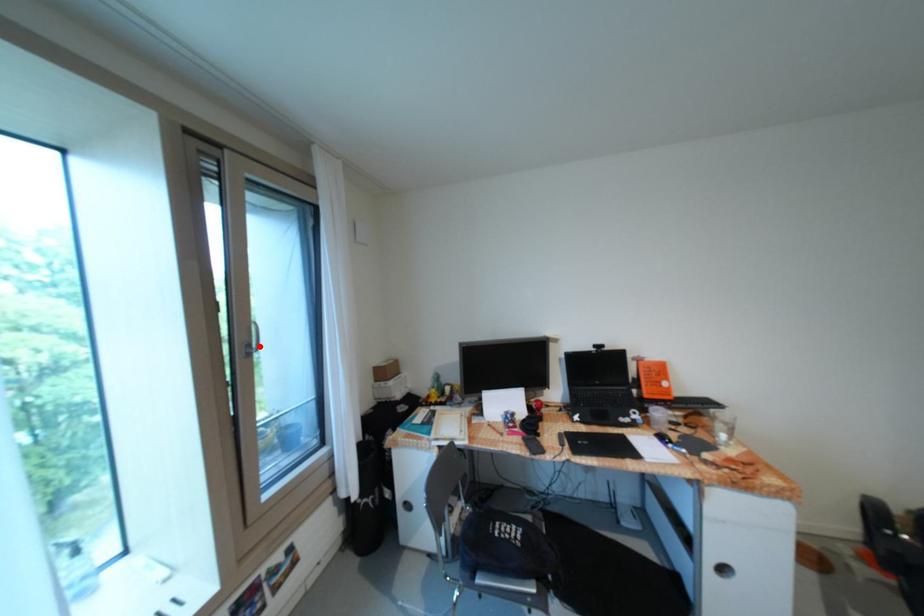
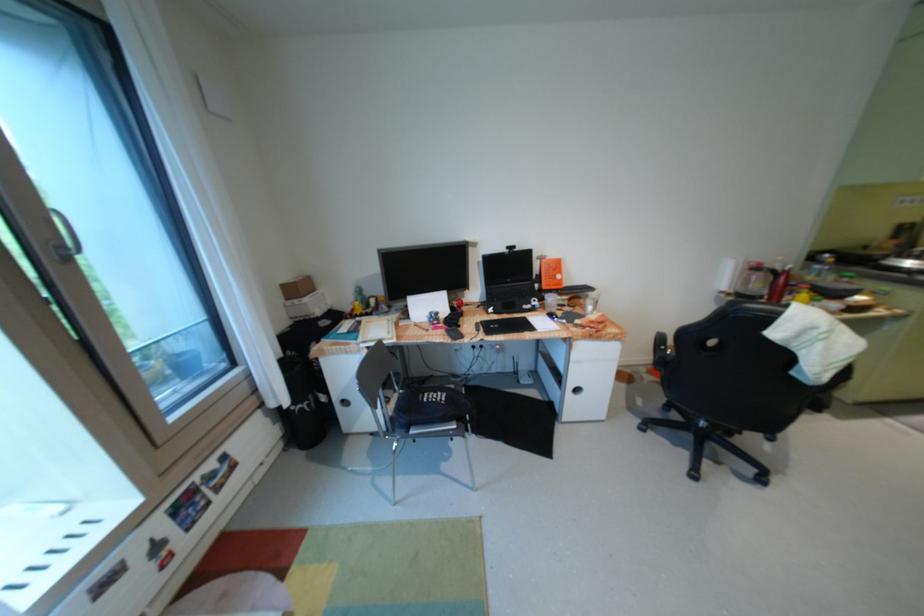
Question: A red point is marked in image1. In image2, is the corresponding 3D point closer to the camera or farther? Reply with the corresponding letter.

Choices:
 (A) The corresponding 3D point is closer.
 (B) The corresponding 3D point is farther.

Answer: (B)